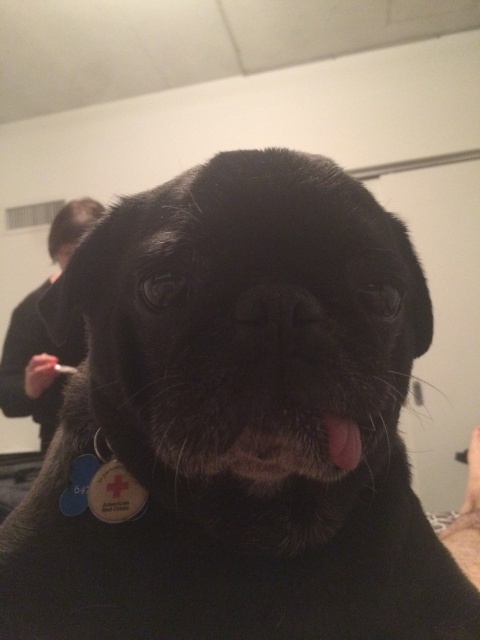
You are a veterinarian examining a dog and notice two features on its face. The first is the pink fur at center and the second is the black matte nose at center. Which of these two features is positioned higher up on the dog?

The pink fur at center is much taller than the black matte nose at center, so the pink fur at center is positioned higher up on the dog.